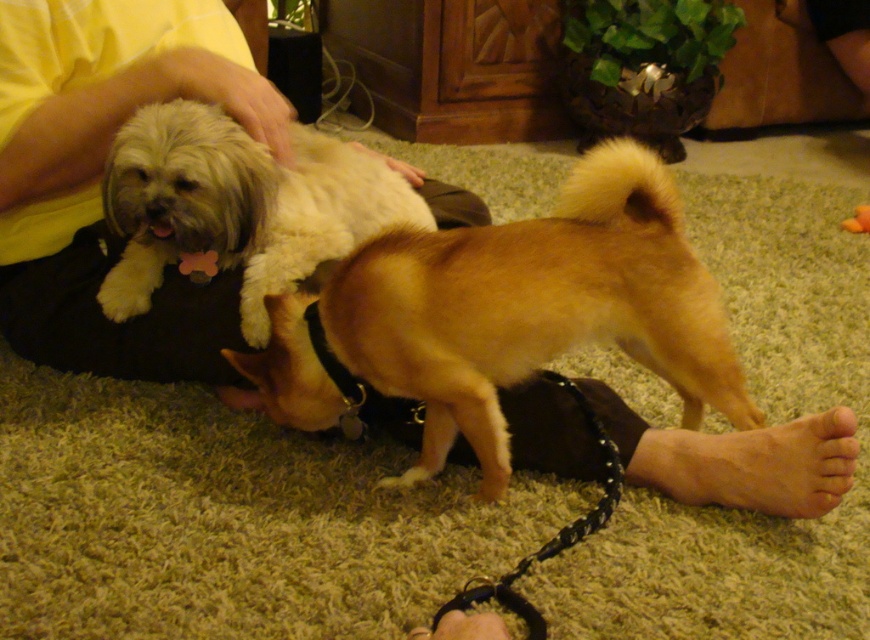
Can you confirm if light brown fur at center is positioned above skinny barefoot at lower right?

Correct, light brown fur at center is located above skinny barefoot at lower right.

Is point (362, 368) closer to camera compared to point (687, 429)?

That is True.

You are a GUI agent. You are given a task and a screenshot of the screen. Output one action in this format:
    pyautogui.click(x=<x>, y=<y>)
    Task: Click on the light brown fur at center
    This screenshot has height=640, width=870.
    Given the screenshot: What is the action you would take?
    pyautogui.click(x=507, y=314)

Consider the image. Who is positioned more to the left, white fluffy dog at upper left or skinny barefoot at lower right?

white fluffy dog at upper left

Which is below, white fluffy dog at upper left or skinny barefoot at lower right?

skinny barefoot at lower right is lower down.

Where is `white fluffy dog at upper left`? white fluffy dog at upper left is located at coordinates (238, 205).

Which is in front, point (579, 198) or point (172, 208)?

Point (579, 198)

The width and height of the screenshot is (870, 640). I want to click on light brown fur at center, so click(507, 314).